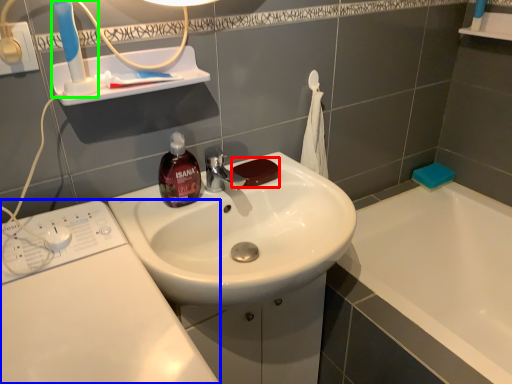
Question: Which is nearer to the soap (highlighted by a red box)? washing machine (highlighted by a blue box) or toothbrush (highlighted by a green box).

Choices:
 (A) washing machine
 (B) toothbrush

Answer: (B)